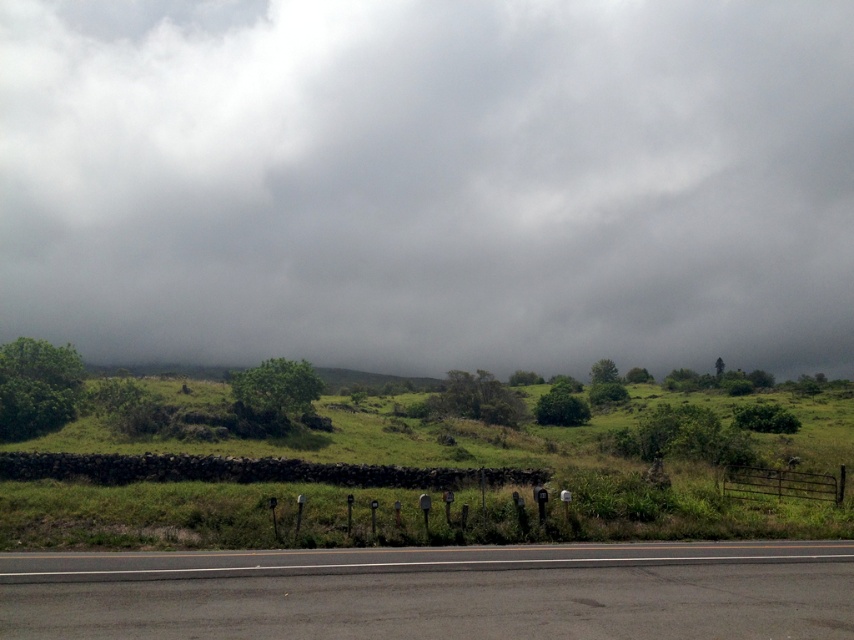
Question: Is gray cloudy sky at upper center below black asphalt highway at lower center?

Choices:
 (A) no
 (B) yes

Answer: (A)

Question: Among these points, which one is farthest from the camera?

Choices:
 (A) (571, 561)
 (B) (344, 13)

Answer: (B)

Question: Estimate the real-world distances between objects in this image. Which object is closer to the green grassy hillside at center?

Choices:
 (A) gray cloudy sky at upper center
 (B) black asphalt highway at lower center

Answer: (B)

Question: Does gray cloudy sky at upper center appear under green grassy hillside at center?

Choices:
 (A) no
 (B) yes

Answer: (A)

Question: From the image, what is the correct spatial relationship of green grassy hillside at center in relation to black asphalt highway at lower center?

Choices:
 (A) below
 (B) above

Answer: (A)

Question: Which point is closer to the camera taking this photo?

Choices:
 (A) (685, 516)
 (B) (728, 131)

Answer: (A)